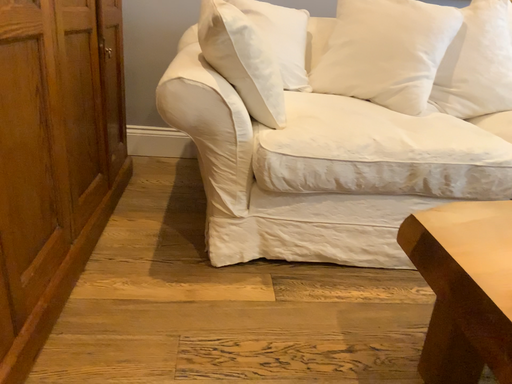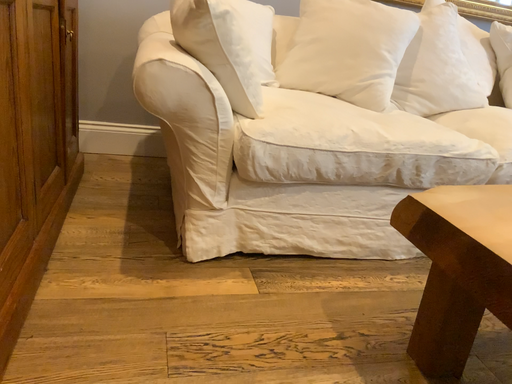
Question: Which way did the camera rotate in the video?

Choices:
 (A) rotated right
 (B) rotated left

Answer: (A)